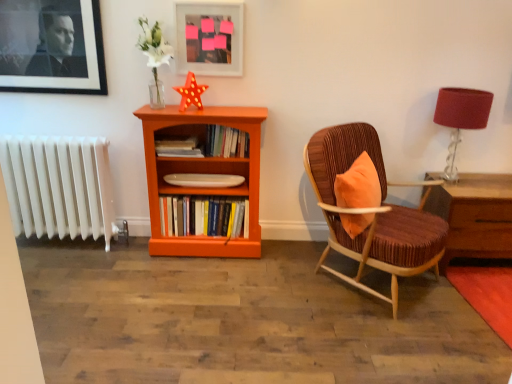
You are a GUI agent. You are given a task and a screenshot of the screen. Output one action in this format:
    pyautogui.click(x=<x>, y=<y>)
    Task: Click on the vacant space to the right of white plastic radiator at left
    The width and height of the screenshot is (512, 384).
    Given the screenshot: What is the action you would take?
    pyautogui.click(x=128, y=266)